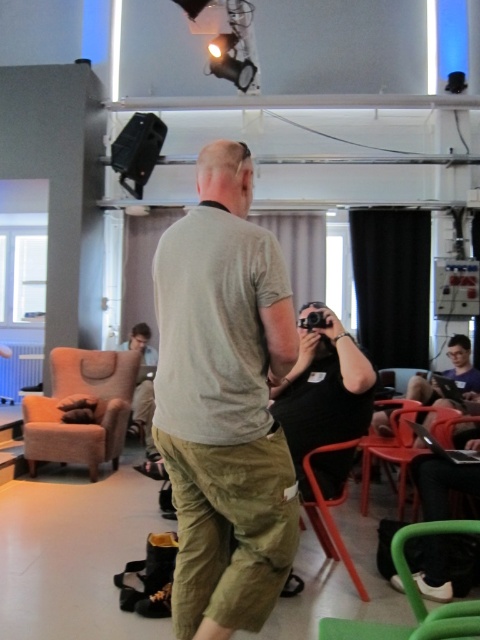
You are standing in the office space and need to move from the khaki pants at center to the green plastic chair at lower right. Which direction should you move to reach the chair?

You should move to the right to reach the green plastic chair at lower right because the khaki pants at center is to the left of it.

Consider the image. You are standing at the point marked by coordinates point (84, 396). Which object is directly to your left?

The beige fabric armchair at left is directly to your left.